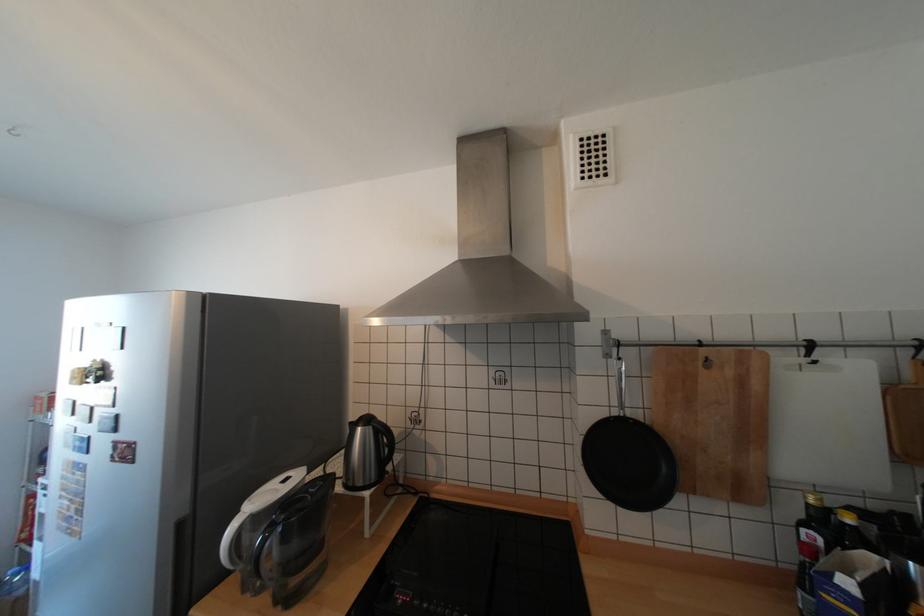
You are a GUI agent. You are given a task and a screenshot of the screen. Output one action in this format:
    pyautogui.click(x=<x>, y=<y>)
    Task: Click on the wooden cutting board
    
    Given the screenshot: What is the action you would take?
    pyautogui.click(x=714, y=419)